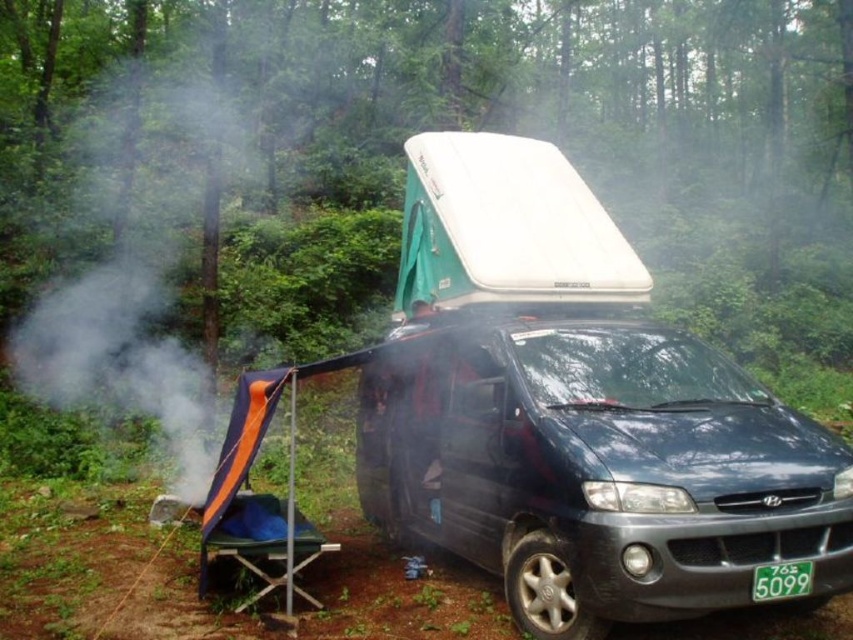
You are setting up camp and need to place a small table between the orange fabric chair at lower left and the green plastic license plate at lower right. Is there enough space between them for the table?

The orange fabric chair at lower left is to the left of the green plastic license plate at lower right, so there is space between them for the table.

You are setting up camp and need to move the orange fabric chair at lower left closer to the fire. However, there is a matte black van at center in the way. Can you move the chair around the van to reach the fire without going through the van?

The matte black van at center is positioned over orange fabric chair at lower left, meaning the van is blocking the path directly to the fire. However, you can move the chair around the van either to the left or right side to reach the fire without going through the van.

Based on the camping scene described, can you determine the relative position of the white smoke at left compared to the green plastic license plate at lower right?

The white smoke at left is located to the left of the green plastic license plate at lower right.